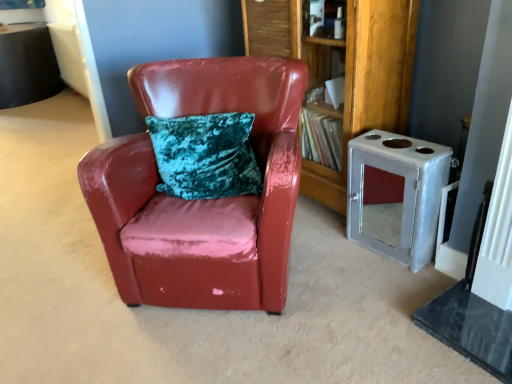
Question: Is glossy leather chair at center in front of or behind metallic silver cabinet at right in the image?

Choices:
 (A) behind
 (B) front

Answer: (B)

Question: Is point (274, 160) closer or farther from the camera than point (372, 188)?

Choices:
 (A) closer
 (B) farther

Answer: (A)

Question: Estimate the real-world distances between objects in this image. Which object is farther from the wooden bookshelf at center?

Choices:
 (A) glossy leather chair at center
 (B) metallic silver cabinet at right

Answer: (A)

Question: Which object is positioned farthest from the metallic silver cabinet at right?

Choices:
 (A) glossy leather chair at center
 (B) wooden bookshelf at center

Answer: (A)